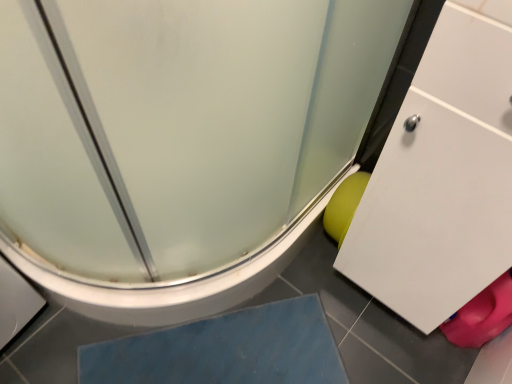
Question: Considering the positions of point (101, 370) and point (105, 279), is point (101, 370) closer or farther from the camera than point (105, 279)?

Choices:
 (A) closer
 (B) farther

Answer: (B)

Question: Looking at the image, does blue rubber mat at lower center seem bigger or smaller compared to frosted glass shower door at lower right?

Choices:
 (A) small
 (B) big

Answer: (A)

Question: Is blue rubber mat at lower center wider or thinner than frosted glass shower door at lower right?

Choices:
 (A) thin
 (B) wide

Answer: (A)

Question: From a real-world perspective, is frosted glass shower door at lower right physically located above or below blue rubber mat at lower center?

Choices:
 (A) below
 (B) above

Answer: (B)

Question: From the image's perspective, is frosted glass shower door at lower right located above or below blue rubber mat at lower center?

Choices:
 (A) below
 (B) above

Answer: (B)

Question: Choose the correct answer: Is frosted glass shower door at lower right inside blue rubber mat at lower center or outside it?

Choices:
 (A) inside
 (B) outside

Answer: (B)

Question: Considering the relative positions of frosted glass shower door at lower right and blue rubber mat at lower center in the image provided, is frosted glass shower door at lower right to the left or to the right of blue rubber mat at lower center?

Choices:
 (A) right
 (B) left

Answer: (B)